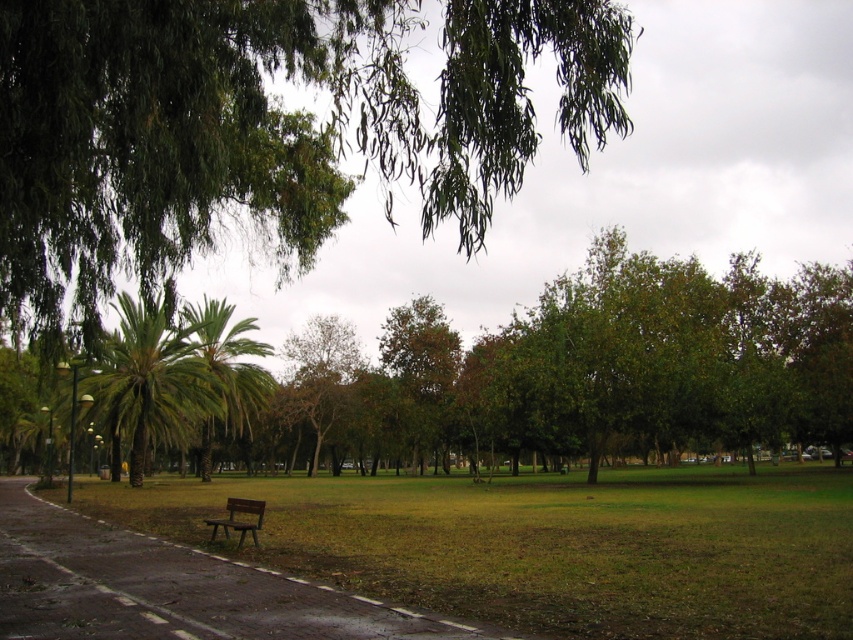
Which is behind, point (187, 116) or point (187, 362)?

The point (187, 362) is more distant.

In the scene shown: How distant is green leafy tree at upper center from green leafy tree at center?

green leafy tree at upper center and green leafy tree at center are 17.77 meters apart from each other.

Image resolution: width=853 pixels, height=640 pixels. In order to click on green leafy tree at upper center in this screenshot , I will do `click(265, 124)`.

Who is positioned more to the left, green leafy tree at center or brown wooden bench at lower center?

brown wooden bench at lower center is more to the left.

Is green leafy tree at center shorter than brown wooden bench at lower center?

No.

Find the location of `green leafy tree at center`. green leafy tree at center is located at coordinates (531, 376).

Measure the distance between green leafy tree at upper center and green leafy palm tree at center.

A distance of 65.50 feet exists between green leafy tree at upper center and green leafy palm tree at center.

Is green leafy tree at upper center smaller than green leafy palm tree at center?

Incorrect, green leafy tree at upper center is not smaller in size than green leafy palm tree at center.

Which is in front, point (496, 54) or point (230, 337)?

Positioned in front is point (496, 54).

You are a GUI agent. You are given a task and a screenshot of the screen. Output one action in this format:
    pyautogui.click(x=<x>, y=<y>)
    Task: Click on the green leafy tree at upper center
    The width and height of the screenshot is (853, 640).
    Given the screenshot: What is the action you would take?
    pyautogui.click(x=265, y=124)